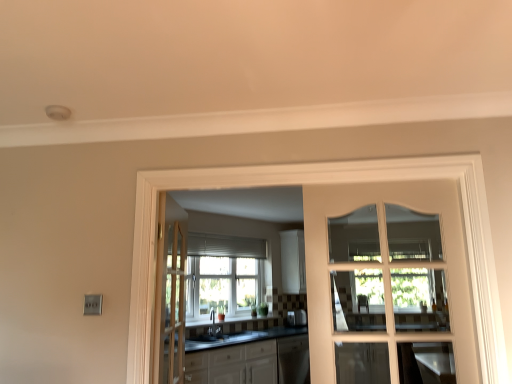
Find the location of a particular element. This screenshot has width=512, height=384. empty space that is ontop of white glass door at center (from a real-world perspective) is located at coordinates (298, 158).